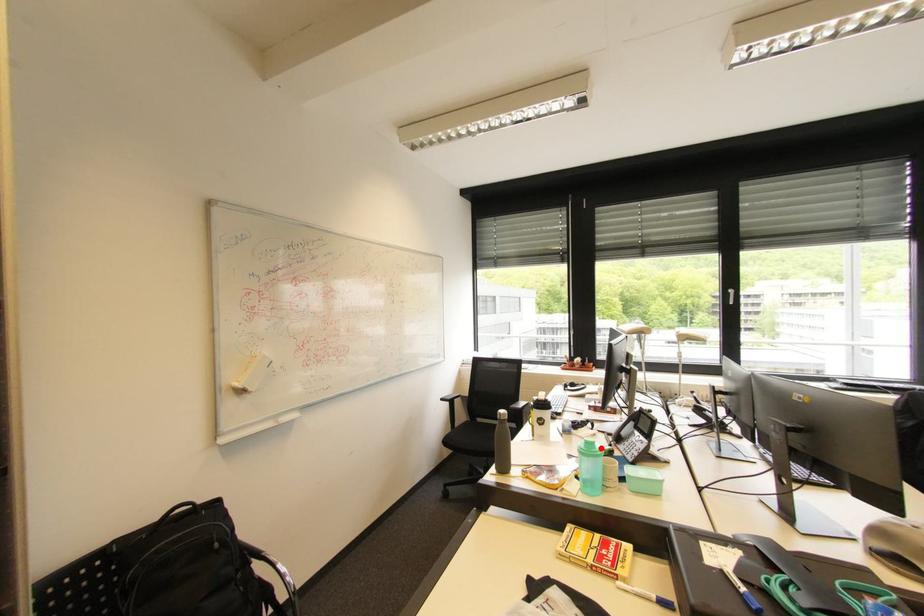
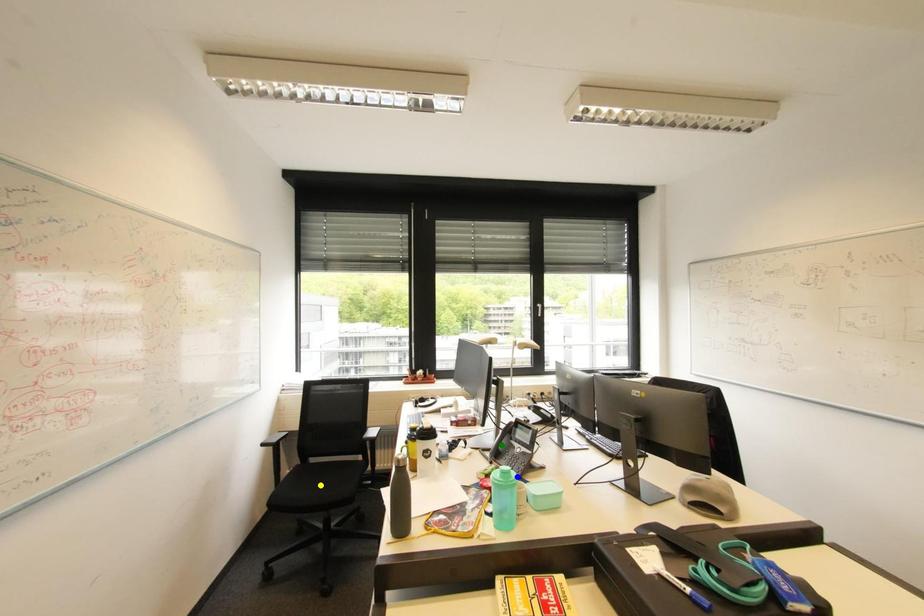
Question: I am providing you with two images of the same scene from different viewpoints. A red point is marked on the first image. You are given multiple points on the second image. Which spot in image 2 lines up with the point in image 1?

Choices:
 (A) blue point
 (B) yellow point
 (C) green point

Answer: (A)